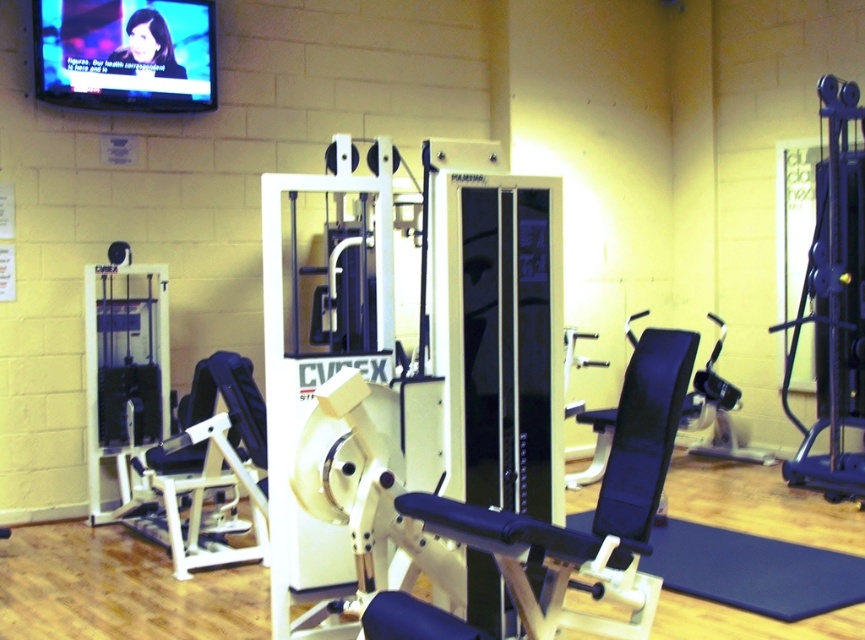
Is matte black television at upper left below blue rubber mat at lower right?

Actually, matte black television at upper left is above blue rubber mat at lower right.

Who is positioned more to the right, matte black television at upper left or blue rubber mat at lower right?

From the viewer's perspective, blue rubber mat at lower right appears more on the right side.

Identify the location of matte black television at upper left. The width and height of the screenshot is (865, 640). (125, 52).

Find the location of a particular element. This screenshot has width=865, height=640. matte black television at upper left is located at coordinates (125, 52).